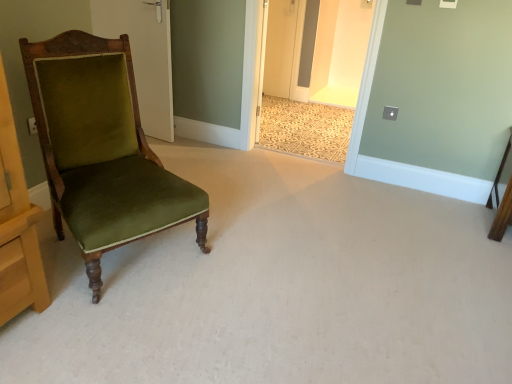
Describe the element at coordinates (102, 149) in the screenshot. I see `velvet green chair at left` at that location.

Image resolution: width=512 pixels, height=384 pixels. I want to click on velvet green chair at left, so click(x=102, y=149).

Describe the element at coordinates (143, 55) in the screenshot. I see `white wood door at upper left` at that location.

Locate an element on the screen. Image resolution: width=512 pixels, height=384 pixels. white wood door at upper left is located at coordinates (143, 55).

What is the approximate width of white wood door at upper left?

white wood door at upper left is 16.63 centimeters in width.

Where is `velvet green chair at left`? velvet green chair at left is located at coordinates (102, 149).

Does white wood door at upper left appear on the right side of velvet green chair at left?

No, white wood door at upper left is not to the right of velvet green chair at left.

Is the depth of white wood door at upper left greater than that of velvet green chair at left?

Yes, white wood door at upper left is further from the camera.

Which point is more distant from viewer, (151, 33) or (46, 152)?

The point (151, 33) is more distant.

From the image's perspective, is white wood door at upper left over velvet green chair at left?

A: Yes.

Looking at this image, from a real-world perspective, is white wood door at upper left above or below velvet green chair at left?

From a real-world perspective, white wood door at upper left is physically above velvet green chair at left.

In terms of width, does white wood door at upper left look wider or thinner when compared to velvet green chair at left?

Considering their sizes, white wood door at upper left looks slimmer than velvet green chair at left.

Can you confirm if white wood door at upper left is shorter than velvet green chair at left?

No.

Considering the relative sizes of white wood door at upper left and velvet green chair at left in the image provided, is white wood door at upper left bigger than velvet green chair at left?

Actually, white wood door at upper left might be smaller than velvet green chair at left.

Is white wood door at upper left situated inside velvet green chair at left or outside?

white wood door at upper left exists outside the volume of velvet green chair at left.

Is white wood door at upper left touching velvet green chair at left?

white wood door at upper left and velvet green chair at left are not in contact.

Could you tell me if white wood door at upper left is turned towards velvet green chair at left?

No, white wood door at upper left is not aimed at velvet green chair at left.

How many degrees apart are the facing directions of white wood door at upper left and velvet green chair at left?

69.2 degrees separate the facing orientations of white wood door at upper left and velvet green chair at left.

Image resolution: width=512 pixels, height=384 pixels. There is a velvet green chair at left. Identify the location of door above it (from a real-world perspective). (143, 55).

Is velvet green chair at left at the left side of white wood door at upper left?

In fact, velvet green chair at left is to the right of white wood door at upper left.

Is velvet green chair at left in front of or behind white wood door at upper left in the image?

In the image, velvet green chair at left appears in front of white wood door at upper left.

Is point (114, 47) farther from viewer compared to point (144, 74)?

No, it is not.

Based on the photo, from the image's perspective, is velvet green chair at left positioned above or below white wood door at upper left?

Clearly, from the image's perspective, velvet green chair at left is below white wood door at upper left.

From a real-world perspective, between velvet green chair at left and white wood door at upper left, who is vertically higher?

white wood door at upper left.

Is velvet green chair at left wider than white wood door at upper left?

Yes, velvet green chair at left is wider than white wood door at upper left.

Is velvet green chair at left taller or shorter than white wood door at upper left?

Clearly, velvet green chair at left is shorter compared to white wood door at upper left.

Based on their sizes in the image, would you say velvet green chair at left is bigger or smaller than white wood door at upper left?

Considering their sizes, velvet green chair at left takes up more space than white wood door at upper left.

Would you say velvet green chair at left is outside white wood door at upper left?

Yes.

Are velvet green chair at left and white wood door at upper left far apart?

That's right, there is a large distance between velvet green chair at left and white wood door at upper left.

Could you tell me if velvet green chair at left is facing white wood door at upper left?

No, velvet green chair at left is not turned towards white wood door at upper left.

Can you tell me how much velvet green chair at left and white wood door at upper left differ in facing direction?

They differ by 69.2 degrees in their facing directions.

What are the coordinates of `chair located underneath the white wood door at upper left (from a real-world perspective)` in the screenshot? It's located at (102, 149).

Where is `chair on the right of white wood door at upper left`? This screenshot has height=384, width=512. chair on the right of white wood door at upper left is located at coordinates (102, 149).

Find the location of a particular element. This screenshot has height=384, width=512. chair lying below the white wood door at upper left (from the image's perspective) is located at coordinates (102, 149).